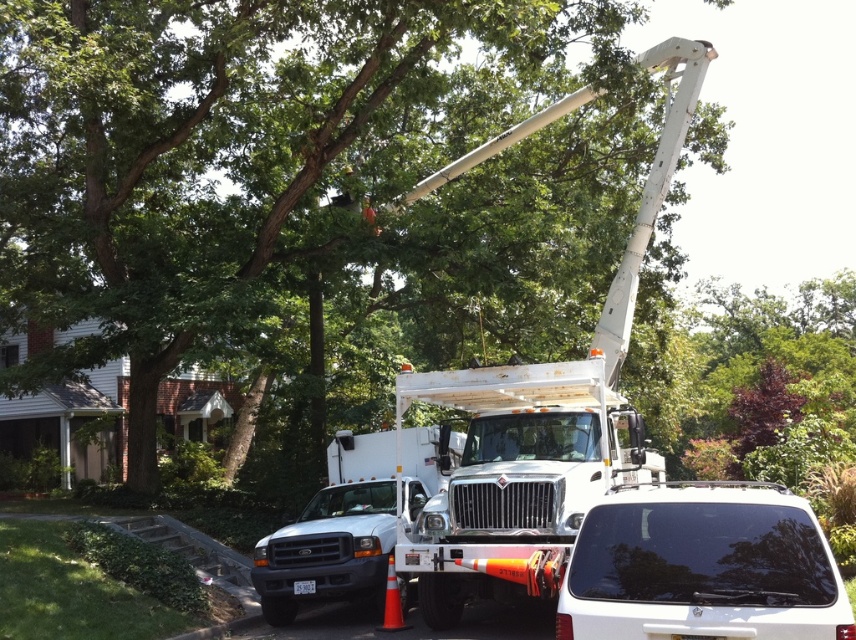
Which is more to the left, white metallic utility truck at center or black glass suv at lower right?

Positioned to the left is white metallic utility truck at center.

Does point (489, 467) lie in front of point (563, 625)?

No.

Locate an element on the screen. white metallic utility truck at center is located at coordinates (514, 477).

In order to click on green leafy tree at center in this screenshot , I will do `click(232, 157)`.

Does green leafy tree at center have a greater height compared to white metallic bucket truck at center?

Yes, green leafy tree at center is taller than white metallic bucket truck at center.

Between point (251, 316) and point (550, 508), which one is positioned behind?

Point (251, 316)

I want to click on green leafy tree at center, so click(x=232, y=157).

Is green leafy tree at center shorter than white metallic utility truck at center?

No, green leafy tree at center is not shorter than white metallic utility truck at center.

Is point (400, 253) closer to viewer compared to point (646, 461)?

No, it is behind (646, 461).

Does point (195, 102) lie behind point (581, 406)?

That is True.

I want to click on green leafy tree at center, so click(x=232, y=157).